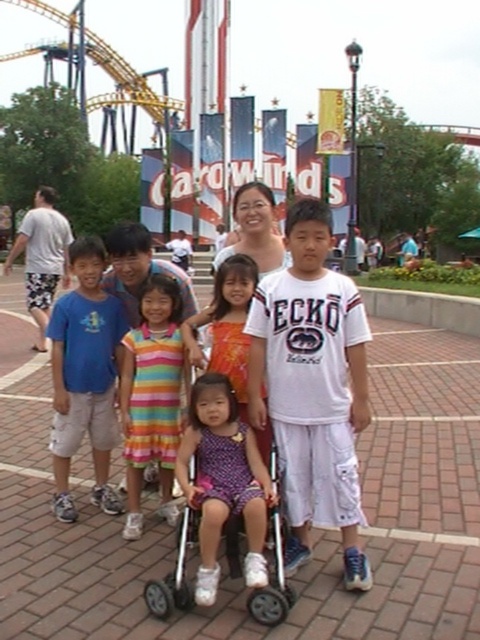
Question: Which object is the closest to the striped cotton dress at center?

Choices:
 (A) white cotton t-shirt at center
 (B) purple satin dress at center
 (C) plastic baby carriage at center

Answer: (A)

Question: Considering the relative positions of white cotton t-shirt at center and blue cotton t-shirt at left in the image provided, where is white cotton t-shirt at center located with respect to blue cotton t-shirt at left?

Choices:
 (A) above
 (B) below

Answer: (A)

Question: Where is blue cotton t-shirt at left located in relation to purple satin dress at center in the image?

Choices:
 (A) right
 (B) left

Answer: (B)

Question: Can you confirm if purple satin dress at center is positioned to the right of plastic baby carriage at center?

Choices:
 (A) yes
 (B) no

Answer: (B)

Question: Which point is closer to the camera?

Choices:
 (A) (86, 326)
 (B) (348, 417)

Answer: (B)

Question: Which of these objects is positioned closest to the blue cotton t-shirt at left?

Choices:
 (A) white cotton t-shirt at center
 (B) striped cotton dress at center

Answer: (B)